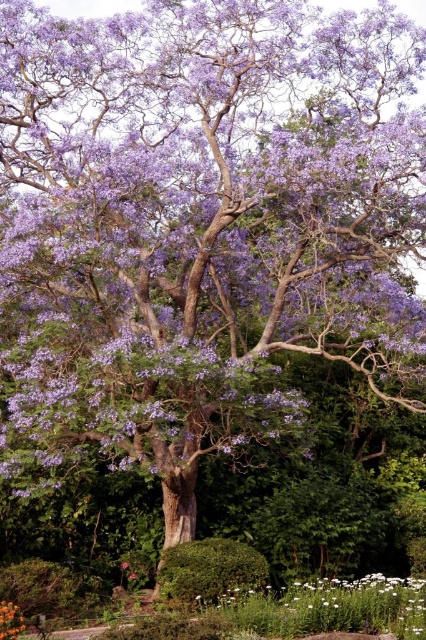
Is white matte flowers at lower right bigger than orange matte flower at center?

Yes.

Does point (317, 608) come behind point (2, 627)?

That is True.

The image size is (426, 640). Identify the location of white matte flowers at lower right. (334, 609).